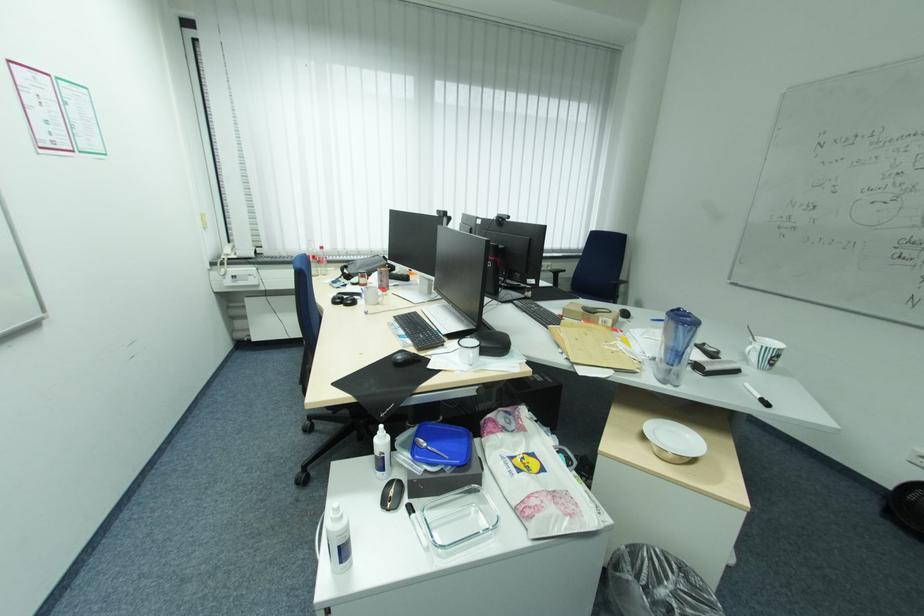
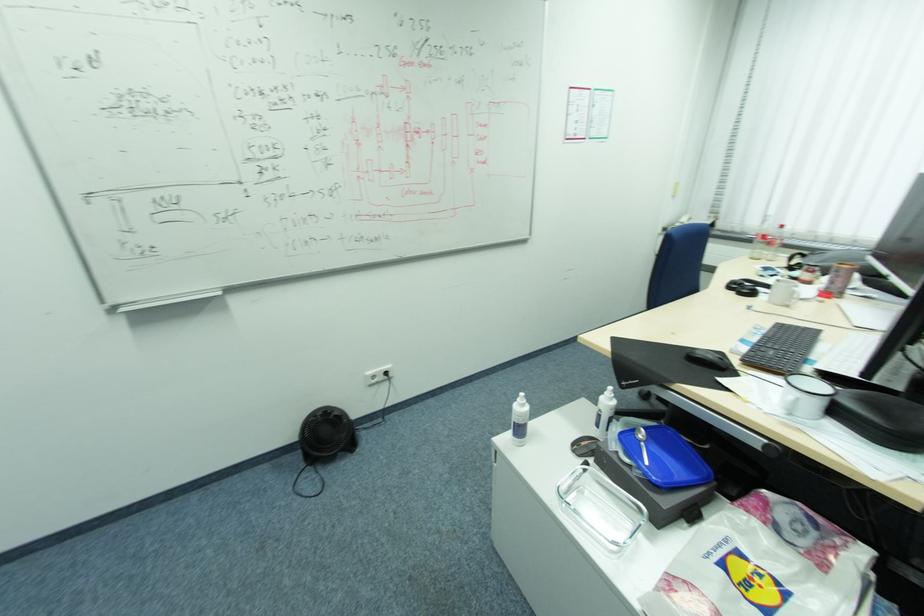
Question: I am providing you with two images of the same scene from different viewpoints. After the viewpoint changes to image2, which objects are now occluded?

Choices:
 (A) white plastic bottle
 (B) glass food container
 (C) black computer mouse
 (D) none of these

Answer: (D)